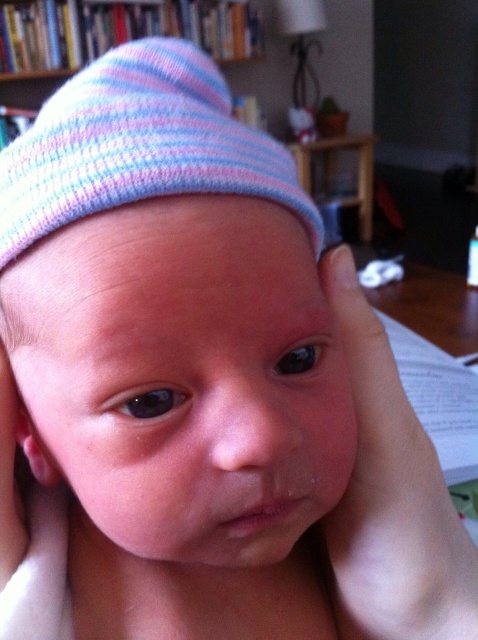
You are a photographer setting up for a baby photo shoot. You want to ensure the baby stays in focus while the background remains slightly blurred. Given the smooth skin hand at center and the knitted fabric bookshelf at upper center, which object should you focus on to achieve this effect?

You should focus on the smooth skin hand at center because it is in front of the knitted fabric bookshelf at upper center, ensuring the baby stays sharp while the background blurs.

You are a photographer setting up a shot of a baby. You have a smooth skin hand at center and a knitted fabric bookshelf at upper center in your frame. Which object is on the right side of the other?

The smooth skin hand at center is positioned on the right side of knitted fabric bookshelf at upper center.